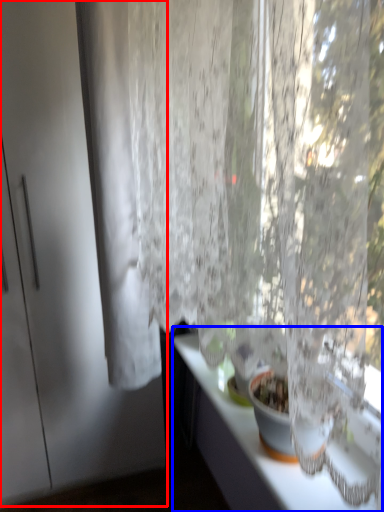
Question: Which object is closer to the camera taking this photo, screen door (highlighted by a red box) or counter top (highlighted by a blue box)?

Choices:
 (A) screen door
 (B) counter top

Answer: (B)